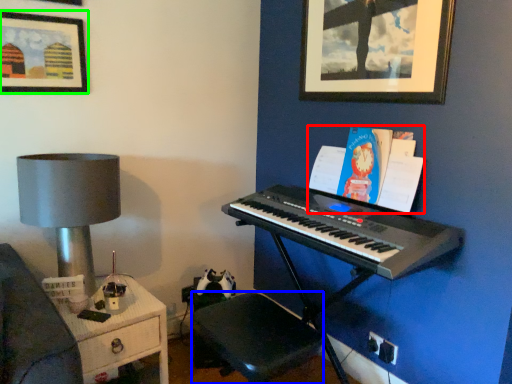
Question: Which object is positioned closest to book (highlighted by a red box)? Select from music stool (highlighted by a blue box) and picture frame (highlighted by a green box).

Choices:
 (A) music stool
 (B) picture frame

Answer: (A)